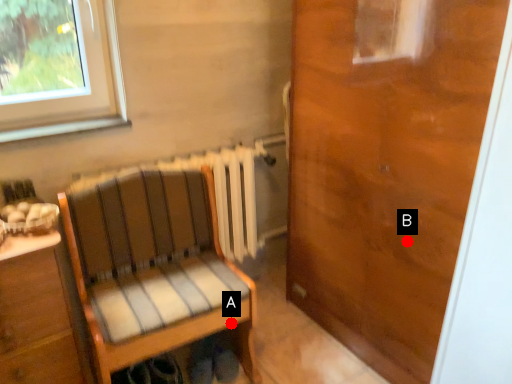
Question: Two points are circled on the image, labeled by A and B beside each circle. Among these points, which one is farthest from the camera?

Choices:
 (A) A is further
 (B) B is further

Answer: (A)